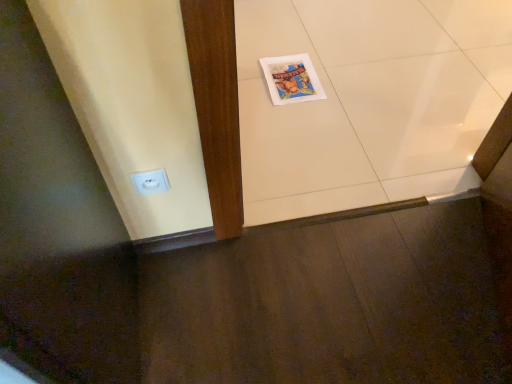
Question: From a real-world perspective, relative to white glossy tile at center, is matte paper comic book at center vertically above or below?

Choices:
 (A) above
 (B) below

Answer: (A)

Question: In the image, is matte paper comic book at center on the left side or the right side of white glossy tile at center?

Choices:
 (A) right
 (B) left

Answer: (B)

Question: Which of these objects is positioned closest to the white plastic electric outlet at lower left?

Choices:
 (A) white glossy tile at center
 (B) matte paper comic book at center

Answer: (B)

Question: Which of these objects is positioned farthest from the white glossy tile at center?

Choices:
 (A) matte paper comic book at center
 (B) white plastic electric outlet at lower left

Answer: (B)